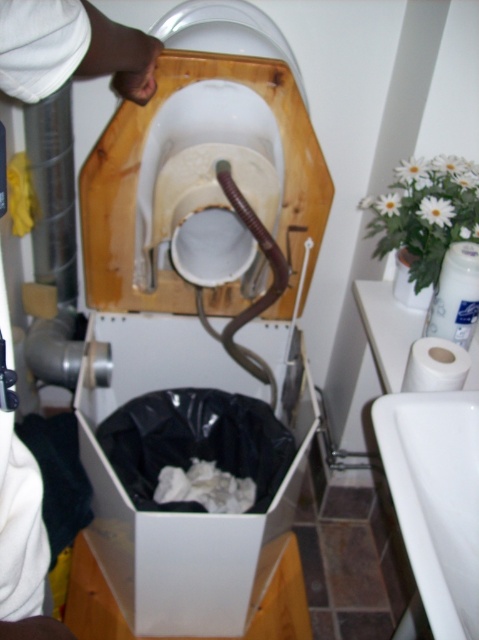
Question: Which of the following is the closest to the observer?

Choices:
 (A) white plastic box at lower center
 (B) white glossy sink at lower right

Answer: (B)

Question: Does white plastic box at lower center have a smaller size compared to white glossy toilet bowl at center?

Choices:
 (A) no
 (B) yes

Answer: (A)

Question: Can you confirm if white glossy toilet bowl at center is positioned to the left of white matte toilet paper at lower right?

Choices:
 (A) no
 (B) yes

Answer: (B)

Question: Which point is farther to the camera?

Choices:
 (A) white plastic box at lower center
 (B) white matte toilet paper at lower right

Answer: (A)

Question: Which object appears farthest from the camera in this image?

Choices:
 (A) white plastic box at lower center
 (B) white glossy toilet bowl at center
 (C) white glossy sink at lower right

Answer: (A)

Question: Can you confirm if white plastic box at lower center is positioned to the left of white glossy toilet bowl at center?

Choices:
 (A) yes
 (B) no

Answer: (A)